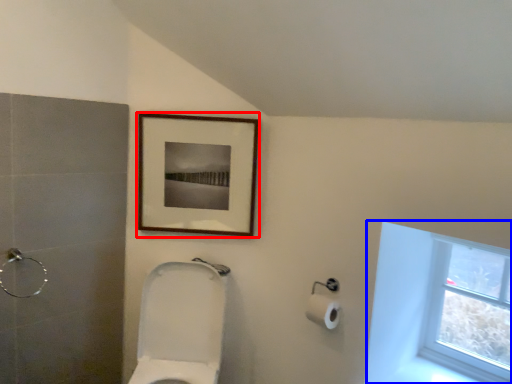
Question: Which of the following is the farthest to the observer, picture frame (highlighted by a red box) or window (highlighted by a blue box)?

Choices:
 (A) picture frame
 (B) window

Answer: (A)